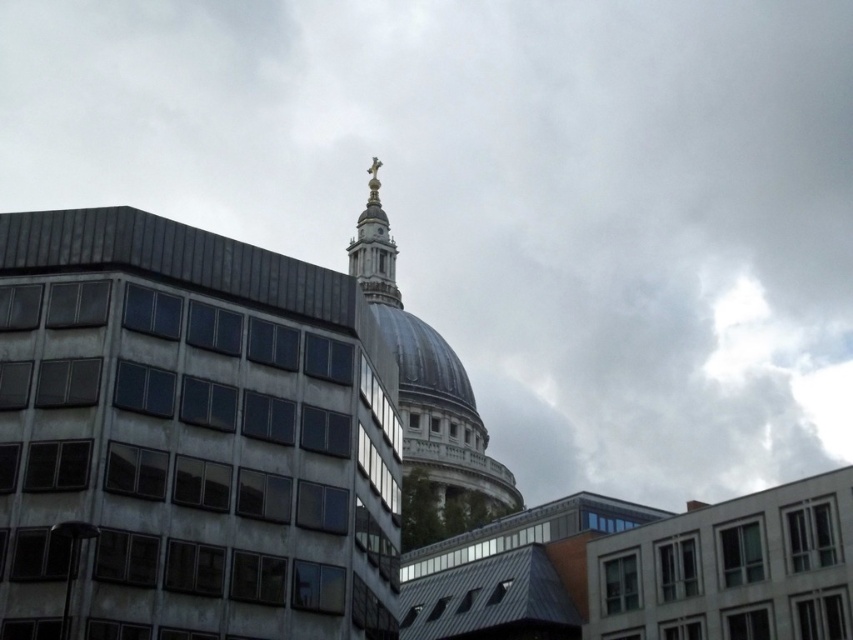
You are an architect analyzing the architectural details of the scene. You notice two spires labeled gold metallic spire at upper center and gold polished metal spire at upper center. Which spire has a greater width?

The gold metallic spire at upper center has a greater width than the gold polished metal spire at upper center.

You are standing in front of the historic dome structure and want to take a photo. There are two points marked in the scene, point [457,410] and point [445,388]. Which point should you stand at to ensure the dome is closer to the camera?

You should stand at point [457,410] because it is in front of point [445,388], making the dome appear closer in the photo.